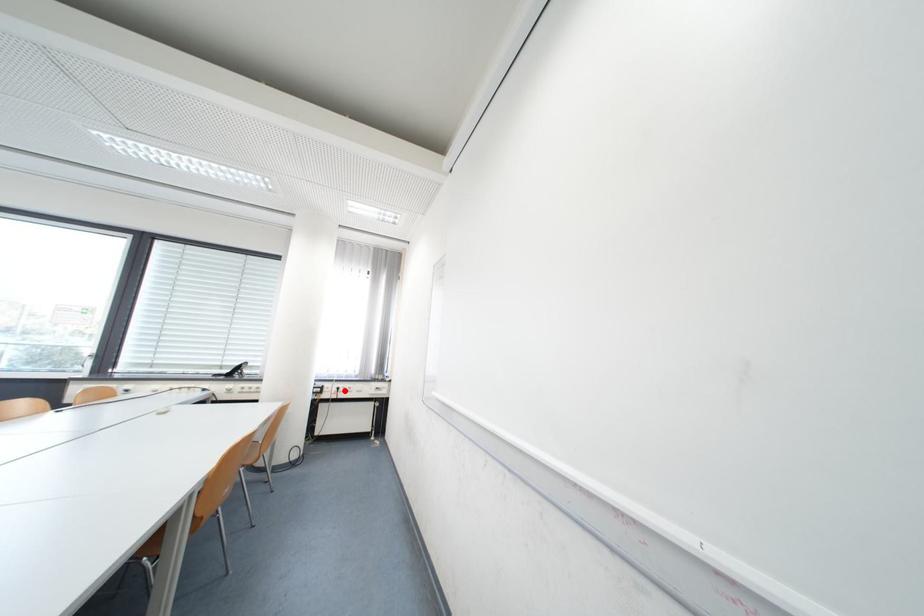
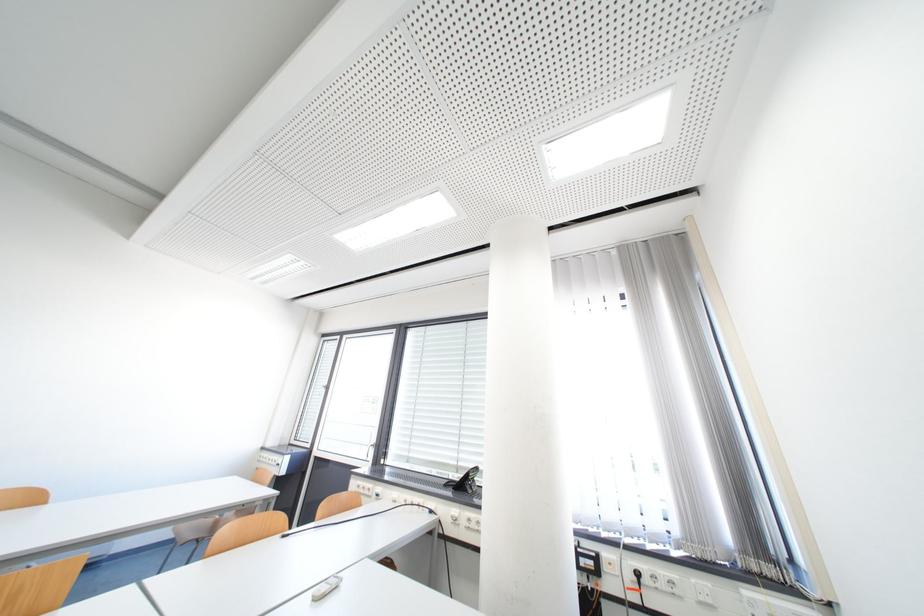
Find the pixel in the second image that matches the highlighted location in the first image.

(639, 578)